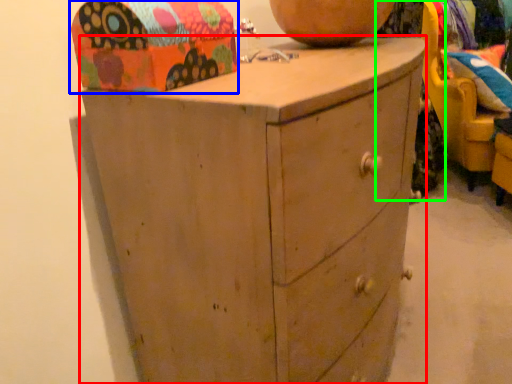
Question: Estimate the real-world distances between objects in this image. Which object is farther from chest of drawers (highlighted by a red box), shoe box (highlighted by a blue box) or clothing (highlighted by a green box)?

Choices:
 (A) shoe box
 (B) clothing

Answer: (B)